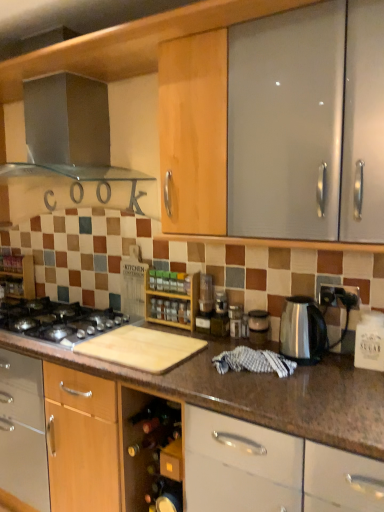
Where is `vacant area on top of wooden spice rack at left, positioned as the first shelf in back-to-front order (from a real-world perspective)`? The width and height of the screenshot is (384, 512). vacant area on top of wooden spice rack at left, positioned as the first shelf in back-to-front order (from a real-world perspective) is located at coordinates (13, 254).